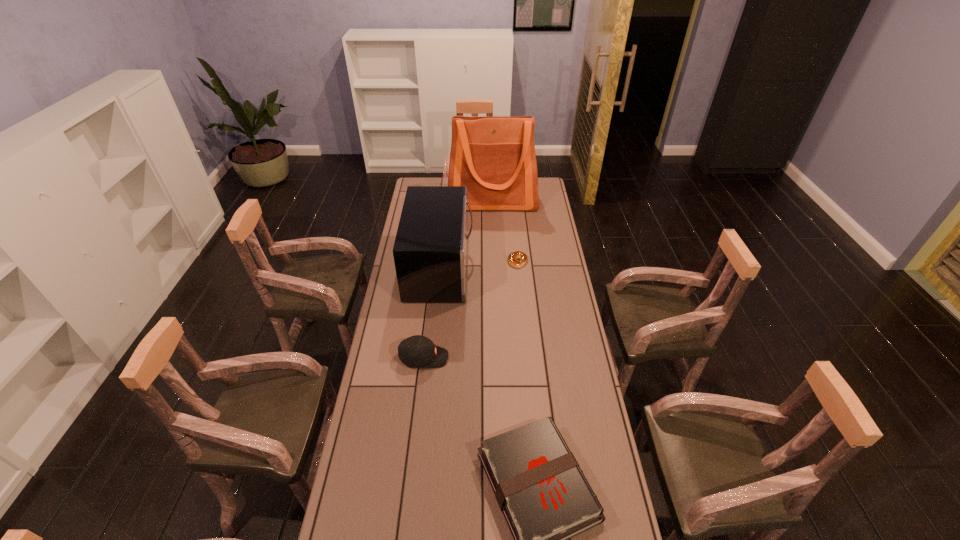
You are a GUI agent. You are given a task and a screenshot of the screen. Output one action in this format:
    pyautogui.click(x=<x>, y=<y>)
    Task: Click on the shopping bag
    Image resolution: width=960 pixels, height=540 pixels.
    Given the screenshot: What is the action you would take?
    pyautogui.click(x=494, y=157)

Identify the location of the tallest object. (494, 157).

Locate an element on the screen. Image resolution: width=960 pixels, height=540 pixels. the fourth shortest object is located at coordinates (430, 251).

What are the coordinates of `baseball cap` in the screenshot? It's located at (416, 351).

The image size is (960, 540). In order to click on the shortest object in this screenshot , I will do `click(512, 258)`.

Locate an element on the screen. The height and width of the screenshot is (540, 960). free region located on the front pocket of the farthest object is located at coordinates (494, 253).

Where is `free space located with the door open on the fourth shortest object`? The height and width of the screenshot is (540, 960). free space located with the door open on the fourth shortest object is located at coordinates (490, 268).

Locate an element on the screen. The image size is (960, 540). vacant area located with a logo on the front of the baseball cap is located at coordinates (469, 357).

What are the coordinates of `free spot located on the left of the bagel` in the screenshot? It's located at (483, 261).

Locate an element on the screen. Image resolution: width=960 pixels, height=540 pixels. object that is positioned at the far edge is located at coordinates [494, 157].